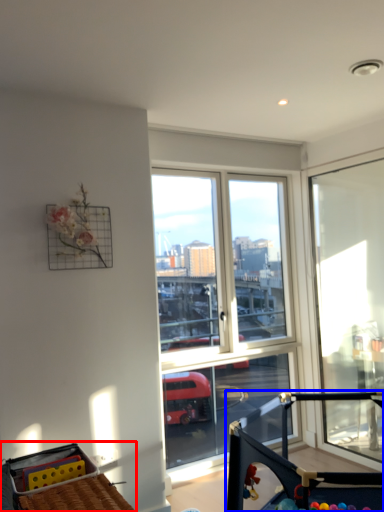
Question: Which point is further to the camera, baby carriage (highlighted by a red box) or baby carriage (highlighted by a blue box)?

Choices:
 (A) baby carriage
 (B) baby carriage

Answer: (A)